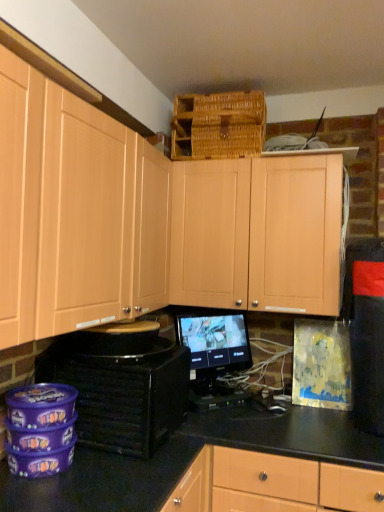
Find the location of a particular element. The image size is (384, 512). free space above black glossy counter top at center (from a real-world perspective) is located at coordinates (306, 436).